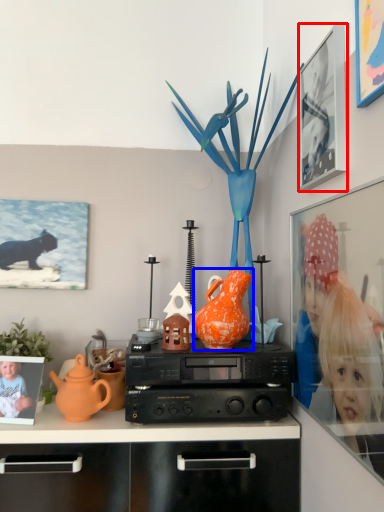
Question: Which object appears closest to the camera in this image, picture frame (highlighted by a red box) or vase (highlighted by a blue box)?

Choices:
 (A) picture frame
 (B) vase

Answer: (A)